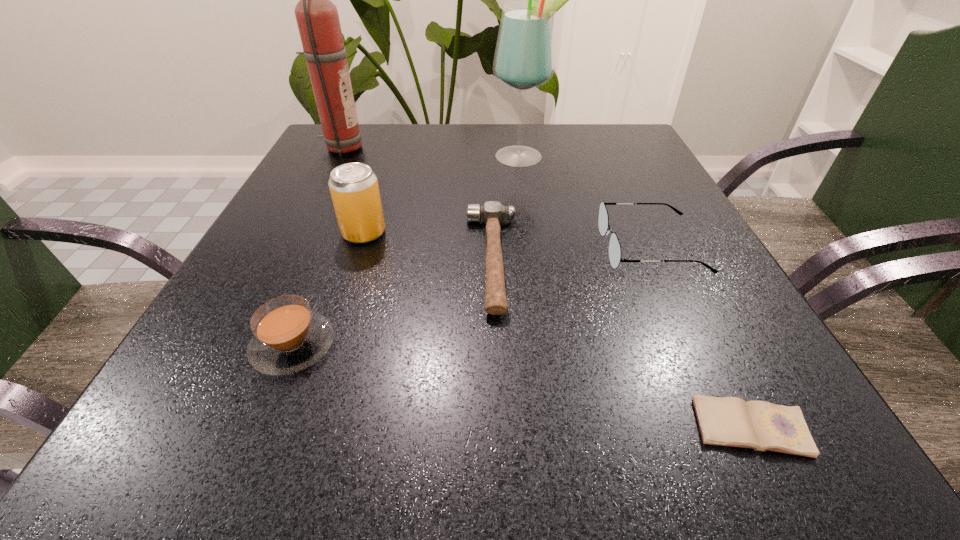
Find the location of a particular element. alcohol is located at coordinates (524, 59).

I want to click on fire extinguisher, so click(x=317, y=18).

Locate an element on the screen. the third tallest object is located at coordinates (354, 189).

Image resolution: width=960 pixels, height=540 pixels. I want to click on cappuccino, so click(289, 337).

Locate an element on the screen. spectacles is located at coordinates (614, 246).

You are a GUI agent. You are given a task and a screenshot of the screen. Output one action in this format:
    pyautogui.click(x=<x>, y=<y>)
    Task: Click on the second shortest object
    
    Given the screenshot: What is the action you would take?
    pyautogui.click(x=492, y=213)

Identify the location of the nearest object. The height and width of the screenshot is (540, 960). (728, 421).

This screenshot has width=960, height=540. Find the location of `the shortest object`. the shortest object is located at coordinates tap(728, 421).

Find the location of a particular element. vacant position located on the left of the alcohol is located at coordinates (360, 157).

In order to click on free spot located 0.170m on the side of the fire extinguisher with the label and nozzle in this screenshot , I will do `click(430, 148)`.